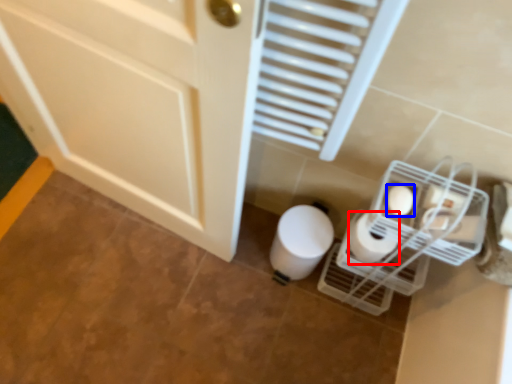
Question: Among these objects, which one is farthest to the camera, toilet paper (highlighted by a red box) or toilet paper (highlighted by a blue box)?

Choices:
 (A) toilet paper
 (B) toilet paper

Answer: (A)